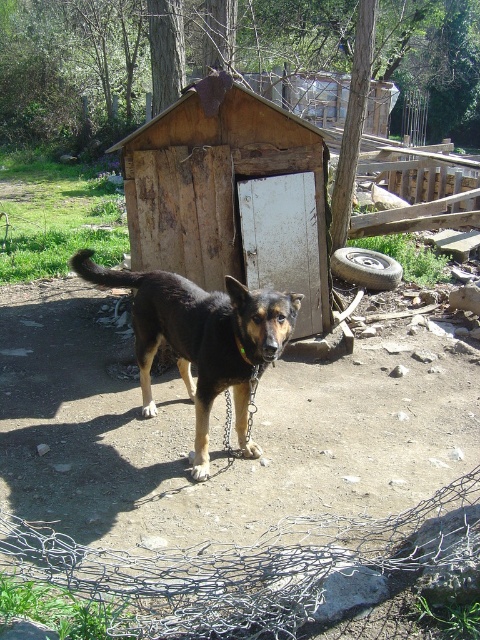
Can you confirm if weathered wood hut at center is bigger than black fur dog at center?

No.

Who is more distant from viewer, (295, 333) or (240, 397)?

The point (295, 333) is behind.

Which is in front, point (217, 280) or point (227, 304)?

Point (227, 304) is more forward.

Locate an element on the screen. This screenshot has width=480, height=640. weathered wood hut at center is located at coordinates (231, 198).